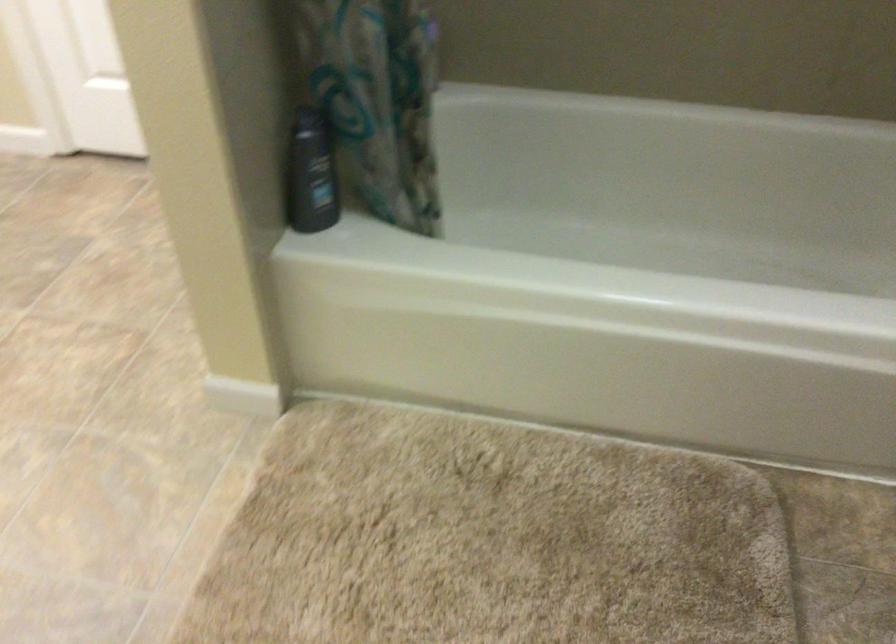
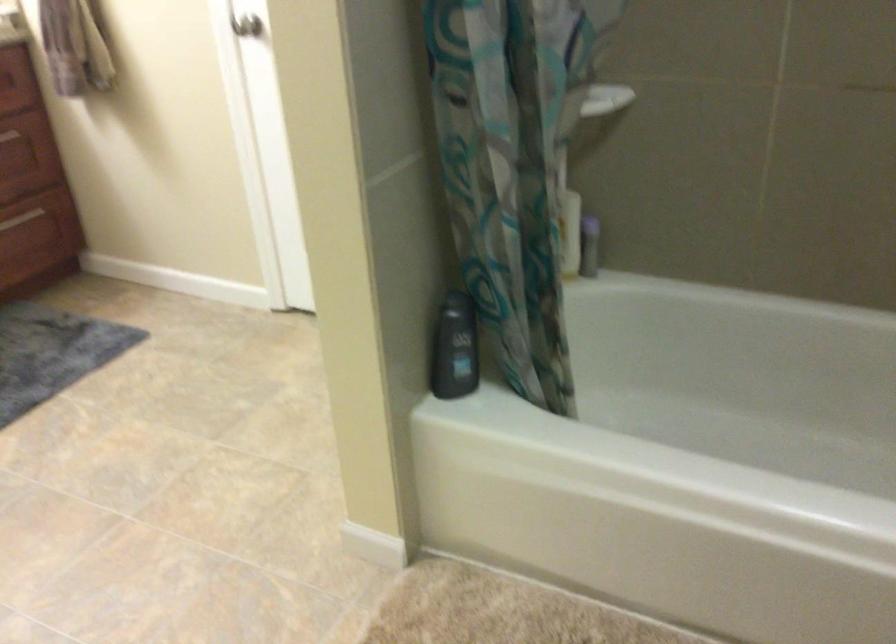
Question: How did the camera likely rotate?

Choices:
 (A) Left
 (B) Right
 (C) Up
 (D) Down

Answer: (A)